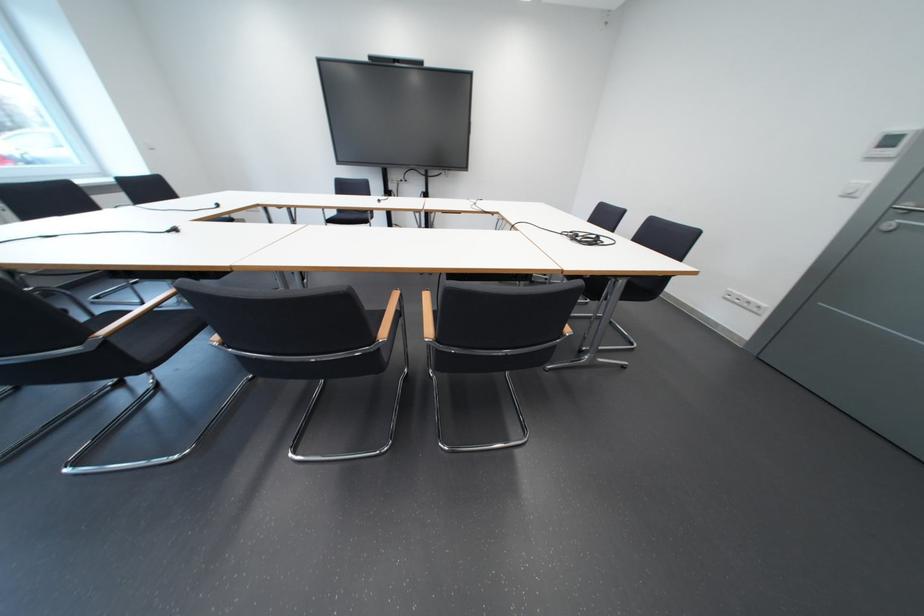
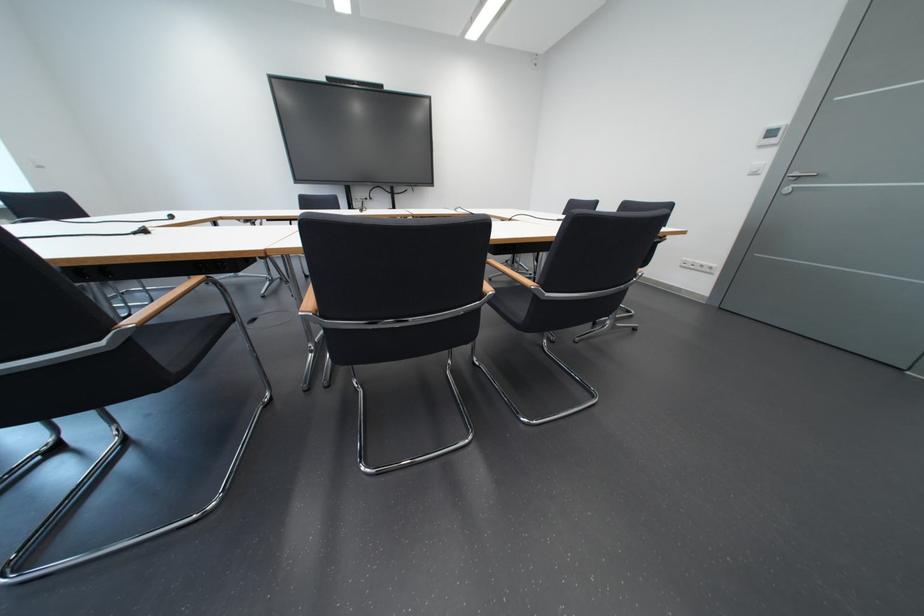
Question: How did the camera likely rotate?

Choices:
 (A) Left
 (B) Right
 (C) Up
 (D) Down

Answer: (B)